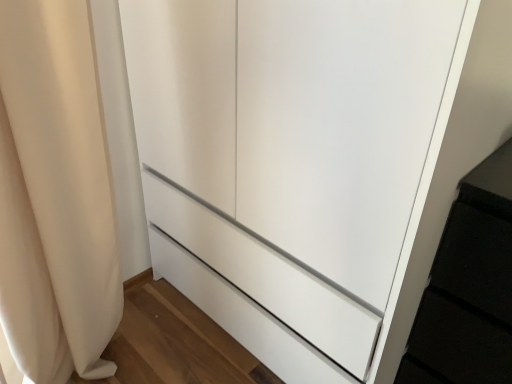
What do you see at coordinates (60, 186) in the screenshot?
I see `beige fabric curtain at left` at bounding box center [60, 186].

Measure the distance between beige fabric curtain at left and camera.

beige fabric curtain at left is 27.62 inches away from camera.

The width and height of the screenshot is (512, 384). In order to click on beige fabric curtain at left in this screenshot , I will do `click(60, 186)`.

Image resolution: width=512 pixels, height=384 pixels. Describe the element at coordinates (291, 162) in the screenshot. I see `white glossy cupboard at center` at that location.

The height and width of the screenshot is (384, 512). Identify the location of white glossy cupboard at center. (291, 162).

At what (x,y) coordinates should I click in order to perform the action: click on beige fabric curtain at left. Please return your answer as a coordinate pair (x, y). Looking at the image, I should click on (60, 186).

Between beige fabric curtain at left and white glossy cupboard at center, which one appears on the right side from the viewer's perspective?

white glossy cupboard at center is more to the right.

Considering the positions of objects beige fabric curtain at left and white glossy cupboard at center in the image provided, who is in front, beige fabric curtain at left or white glossy cupboard at center?

Positioned in front is white glossy cupboard at center.

Which is in front, point (56, 17) or point (405, 182)?

The point (405, 182) is closer to the camera.

From the image's perspective, between beige fabric curtain at left and white glossy cupboard at center, who is located below?

beige fabric curtain at left is shown below in the image.

From a real-world perspective, which object stands above the other?

white glossy cupboard at center is physically above.

Is beige fabric curtain at left wider than white glossy cupboard at center?

In fact, beige fabric curtain at left might be narrower than white glossy cupboard at center.

Is beige fabric curtain at left taller or shorter than white glossy cupboard at center?

beige fabric curtain at left is shorter than white glossy cupboard at center.

Who is smaller, beige fabric curtain at left or white glossy cupboard at center?

beige fabric curtain at left is smaller.

Is beige fabric curtain at left inside or outside of white glossy cupboard at center?

beige fabric curtain at left lies outside white glossy cupboard at center.

Are beige fabric curtain at left and white glossy cupboard at center located far from each other?

Actually, beige fabric curtain at left and white glossy cupboard at center are a little close together.

Is beige fabric curtain at left facing towards white glossy cupboard at center?

No.

Measure the distance between beige fabric curtain at left and white glossy cupboard at center.

beige fabric curtain at left and white glossy cupboard at center are 15.72 inches apart.

Find the location of a particular element. The image size is (512, 384). curtain below the white glossy cupboard at center (from the image's perspective) is located at coordinates (60, 186).

Between white glossy cupboard at center and beige fabric curtain at left, which one appears on the left side from the viewer's perspective?

beige fabric curtain at left.

Which is behind, white glossy cupboard at center or beige fabric curtain at left?

beige fabric curtain at left is further away from the camera.

Is point (372, 155) more distant than point (87, 41)?

That is False.

From the image's perspective, between white glossy cupboard at center and beige fabric curtain at left, who is located below?

beige fabric curtain at left is shown below in the image.

Based on the photo, from a real-world perspective, is white glossy cupboard at center physically located above or below beige fabric curtain at left?

Clearly, from a real-world perspective, white glossy cupboard at center is above beige fabric curtain at left.

Which of these two, white glossy cupboard at center or beige fabric curtain at left, is wider?

white glossy cupboard at center.

In terms of height, does white glossy cupboard at center look taller or shorter compared to beige fabric curtain at left?

In the image, white glossy cupboard at center appears to be taller than beige fabric curtain at left.

Which of these two, white glossy cupboard at center or beige fabric curtain at left, is smaller?

beige fabric curtain at left is smaller.

Is white glossy cupboard at center inside the boundaries of beige fabric curtain at left, or outside?

white glossy cupboard at center lies outside beige fabric curtain at left.

Is white glossy cupboard at center touching beige fabric curtain at left?

white glossy cupboard at center and beige fabric curtain at left are not in contact.

Is white glossy cupboard at center facing away from beige fabric curtain at left?

No, white glossy cupboard at center is not facing the opposite direction of beige fabric curtain at left.

How many degrees apart are the facing directions of white glossy cupboard at center and beige fabric curtain at left?

white glossy cupboard at center and beige fabric curtain at left are facing 90 degrees away from each other.

This screenshot has height=384, width=512. In order to click on cupboard in front of the beige fabric curtain at left in this screenshot , I will do `click(291, 162)`.

The width and height of the screenshot is (512, 384). I want to click on curtain beneath the white glossy cupboard at center (from a real-world perspective), so click(60, 186).

At what (x,y) coordinates should I click in order to perform the action: click on cupboard above the beige fabric curtain at left (from a real-world perspective). Please return your answer as a coordinate pair (x, y). The height and width of the screenshot is (384, 512). Looking at the image, I should click on (291, 162).